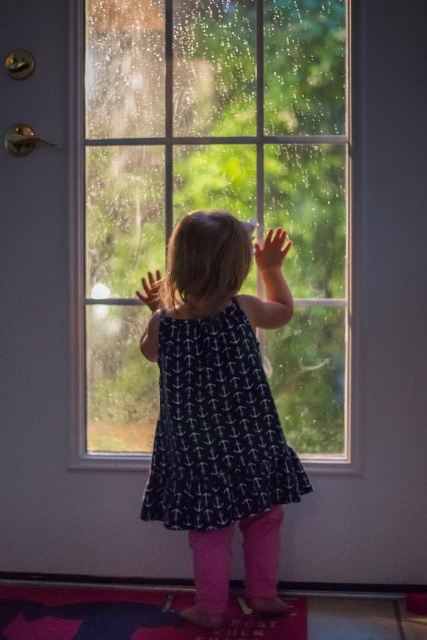
Question: Does clear glass window at center come in front of smooth skin hand at upper center?

Choices:
 (A) no
 (B) yes

Answer: (A)

Question: Can you confirm if clear glass window at center is wider than dark blue dress at center?

Choices:
 (A) yes
 (B) no

Answer: (A)

Question: Which point is closer to the camera taking this photo?

Choices:
 (A) (143, 280)
 (B) (215, 470)

Answer: (B)

Question: Which point appears farthest from the camera in this image?

Choices:
 (A) (201, 481)
 (B) (137, 72)
 (C) (148, 300)
 (D) (277, 240)

Answer: (B)

Question: In this image, where is transparent glass hand at upper center located relative to smooth skin hand at upper center?

Choices:
 (A) right
 (B) left

Answer: (A)

Question: Among these objects, which one is farthest from the camera?

Choices:
 (A) transparent glass hand at upper center
 (B) clear glass window at center
 (C) smooth skin hand at upper center
 (D) dark blue dress at center

Answer: (B)